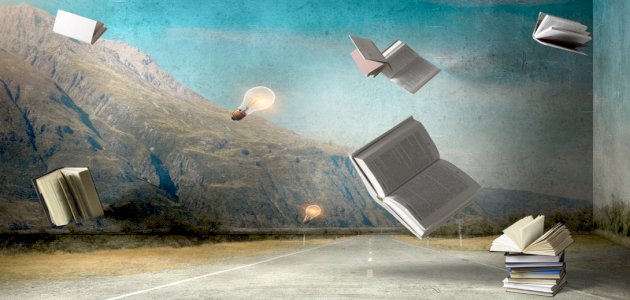
Where is `background wall`? The width and height of the screenshot is (630, 300). background wall is located at coordinates (278, 146).